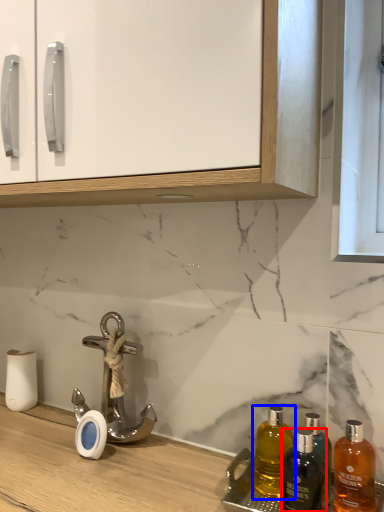
Question: Which object is closer to the camera taking this photo, bottle (highlighted by a red box) or bottle (highlighted by a blue box)?

Choices:
 (A) bottle
 (B) bottle

Answer: (B)